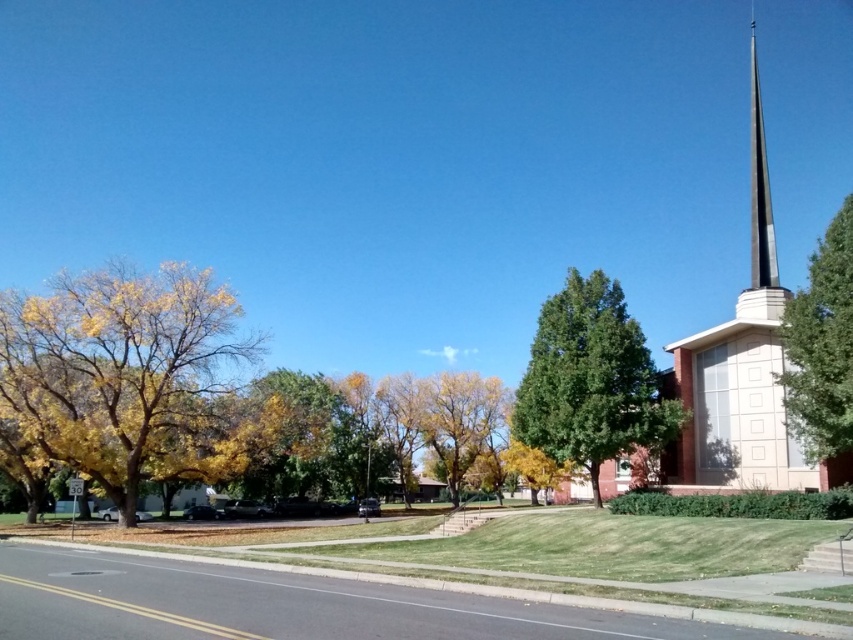
You are a drone operator who needs to capture aerial footage of the smooth tan steeple at right. Your drone has a maximum flight range of 90 feet. Based on the scene description, can your drone safely reach the steeple without exceeding its range limit?

The smooth tan steeple at right is 87.27 feet away from the camera, which is within the drone operator s 90 feet maximum flight range. Therefore, the drone can safely reach the steeple without exceeding its range limit.

Looking at this image, you are a pedestrian standing on the sidewalk. You see a yellow leafy tree at left and a green leafy tree at upper right. Which tree is closer to the road?

The yellow leafy tree at left is closer to the road because it is positioned to the left of the green leafy tree at upper right, which is further away.